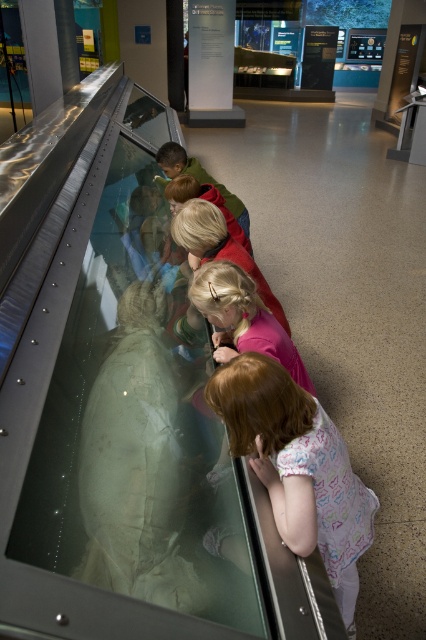
Does light brown fabric dress at lower center come behind pink fabric at center?

No, it is not.

Does light brown fabric dress at lower center appear over pink fabric at center?

Actually, light brown fabric dress at lower center is below pink fabric at center.

Who is more forward, (316, 452) or (239, 292)?

Point (316, 452) is more forward.

Locate an element on the screen. The height and width of the screenshot is (640, 426). light brown fabric dress at lower center is located at coordinates (298, 467).

Where is `pink fabric at center`? pink fabric at center is located at coordinates (242, 317).

Which of these two, pink fabric at center or blonde hair at center, stands shorter?

With less height is pink fabric at center.

I want to click on pink fabric at center, so coord(242,317).

What are the coordinates of `pink fabric at center` in the screenshot? It's located at click(x=242, y=317).

Image resolution: width=426 pixels, height=640 pixels. I want to click on light brown fabric dress at lower center, so click(298, 467).

Image resolution: width=426 pixels, height=640 pixels. I want to click on light brown fabric dress at lower center, so click(x=298, y=467).